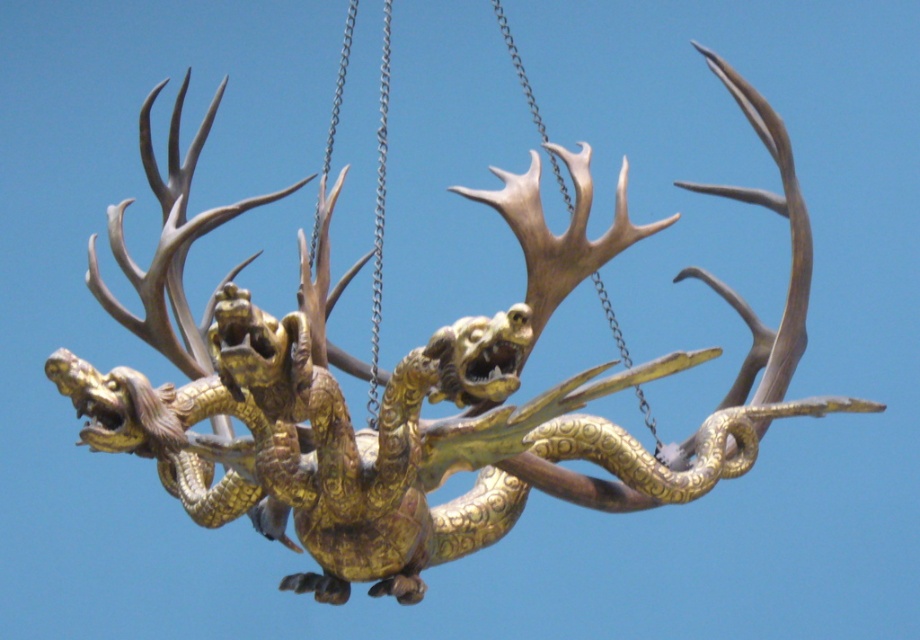
Question: Is silver metallic chain at center smaller than metallic chain at center?

Choices:
 (A) yes
 (B) no

Answer: (A)

Question: Does silver metallic chain at center appear over metallic chain at center?

Choices:
 (A) no
 (B) yes

Answer: (A)

Question: Which object appears closest to the camera in this image?

Choices:
 (A) metallic chain at center
 (B) silver metallic chain at center

Answer: (B)

Question: Can you confirm if silver metallic chain at center is positioned to the left of metallic chain at center?

Choices:
 (A) yes
 (B) no

Answer: (A)

Question: Which point appears farthest from the camera in this image?

Choices:
 (A) (372, 349)
 (B) (595, 284)

Answer: (B)